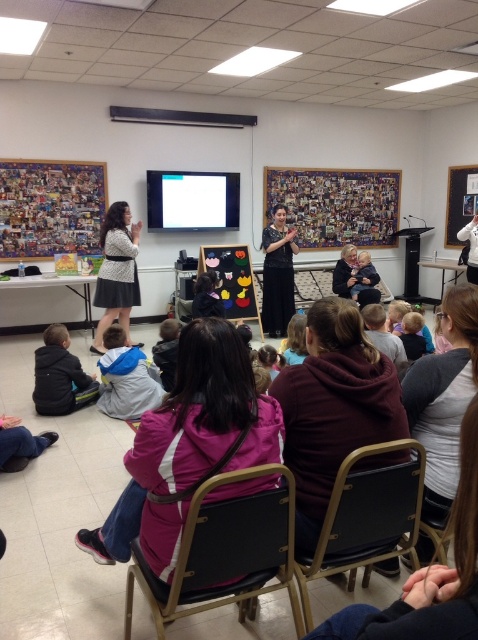
You are organizing a fashion show and need to place two dresses on a runway. The matte black dress at left and the black lace dress at center must be positioned such that there is exactly 6 feet between them. Can you arrange them according to the scene?

Yes, the matte black dress at left and the black lace dress at center can be positioned with exactly 6 feet between them as the distance between them is 6.14 feet, which is slightly more than 6 feet but close enough for arrangement.

You are standing at the point with coordinates [366,518] in the classroom. What object is located exactly at your current position?

The metallic black chair at lower center is located exactly at the point with coordinates [366,518].

You are standing at the origin point of the classroom coordinate system. You need to move to the metallic black chair at lower center. What are the coordinates you need to move to?

The coordinates to move to are 0.811 on the x axis and 0.766 on the y axis.